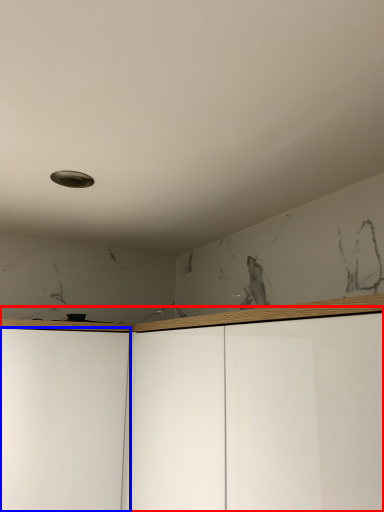
Question: Which object appears closest to the camera in this image, dresser (highlighted by a red box) or glass door (highlighted by a blue box)?

Choices:
 (A) dresser
 (B) glass door

Answer: (A)